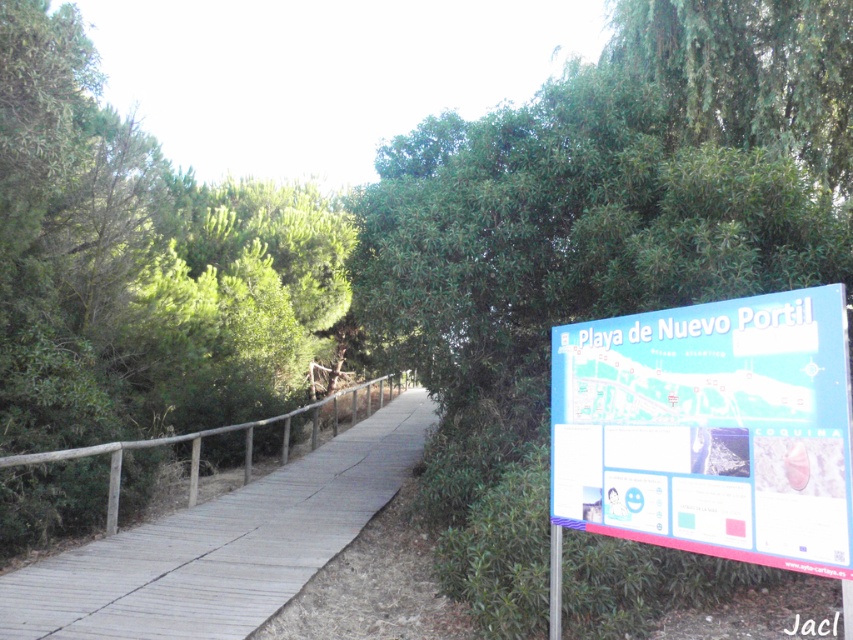
Question: Which of the following is the closest to the observer?

Choices:
 (A) wooden at left
 (B) green leafy tree at left
 (C) blue plastic sign at right

Answer: (C)

Question: Estimate the real-world distances between objects in this image. Which object is closer to the blue plastic sign at right?

Choices:
 (A) green leafy tree at upper right
 (B) green leafy tree at left
 (C) wooden at left

Answer: (C)

Question: Is green leafy tree at left to the left of blue plastic sign at right from the viewer's perspective?

Choices:
 (A) yes
 (B) no

Answer: (A)

Question: Is green leafy tree at upper right further to the viewer compared to green leafy tree at left?

Choices:
 (A) no
 (B) yes

Answer: (B)

Question: Estimate the real-world distances between objects in this image. Which object is closer to the green leafy tree at upper right?

Choices:
 (A) wooden at left
 (B) blue plastic sign at right
 (C) green leafy tree at left

Answer: (A)

Question: Does blue plastic sign at right appear on the left side of wooden at left?

Choices:
 (A) no
 (B) yes

Answer: (A)